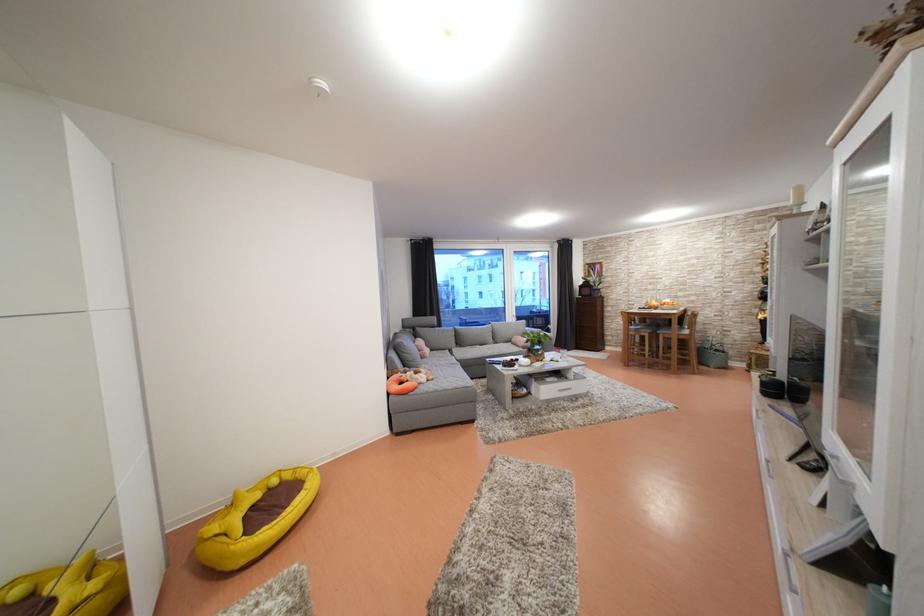
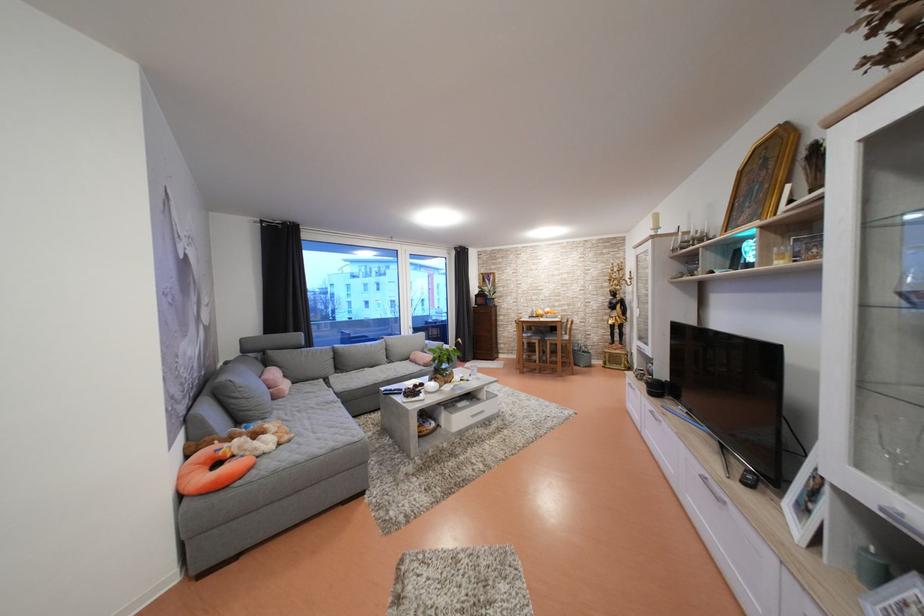
The point at (403, 387) is marked in the first image. Where is the corresponding point in the second image?

(211, 469)